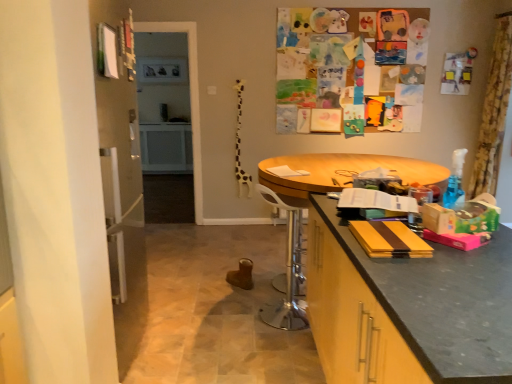
Question: Is yellow floral fabric curtain at upper right bigger than wooden round table at center?

Choices:
 (A) yes
 (B) no

Answer: (B)

Question: Can you confirm if yellow floral fabric curtain at upper right is positioned to the right of wooden round table at center?

Choices:
 (A) no
 (B) yes

Answer: (B)

Question: Considering the relative positions of yellow floral fabric curtain at upper right and wooden round table at center in the image provided, is yellow floral fabric curtain at upper right in front of wooden round table at center?

Choices:
 (A) no
 (B) yes

Answer: (A)

Question: Is yellow floral fabric curtain at upper right to the left of wooden round table at center from the viewer's perspective?

Choices:
 (A) yes
 (B) no

Answer: (B)

Question: Is yellow floral fabric curtain at upper right facing towards wooden round table at center?

Choices:
 (A) no
 (B) yes

Answer: (A)

Question: Choose the correct answer: Is matte black countertop at right inside white plastic swivel chair at center or outside it?

Choices:
 (A) outside
 (B) inside

Answer: (A)

Question: From the image's perspective, relative to white plastic swivel chair at center, is matte black countertop at right above or below?

Choices:
 (A) below
 (B) above

Answer: (A)

Question: Based on their sizes in the image, would you say matte black countertop at right is bigger or smaller than white plastic swivel chair at center?

Choices:
 (A) big
 (B) small

Answer: (A)

Question: Is point (444, 372) positioned closer to the camera than point (293, 296)?

Choices:
 (A) closer
 (B) farther

Answer: (A)

Question: From a real-world perspective, relative to wooden round table at center, is matte black countertop at right vertically above or below?

Choices:
 (A) above
 (B) below

Answer: (B)

Question: Which is correct: matte black countertop at right is inside wooden round table at center, or outside of it?

Choices:
 (A) inside
 (B) outside

Answer: (B)

Question: Is point (489, 251) closer or farther from the camera than point (321, 155)?

Choices:
 (A) closer
 (B) farther

Answer: (A)

Question: Considering the relative positions of matte black countertop at right and wooden round table at center in the image provided, is matte black countertop at right to the left or to the right of wooden round table at center?

Choices:
 (A) left
 (B) right

Answer: (B)

Question: Considering the positions of yellow floral fabric curtain at upper right and white plastic swivel chair at center in the image, is yellow floral fabric curtain at upper right taller or shorter than white plastic swivel chair at center?

Choices:
 (A) short
 (B) tall

Answer: (B)

Question: Based on their sizes in the image, would you say yellow floral fabric curtain at upper right is bigger or smaller than white plastic swivel chair at center?

Choices:
 (A) small
 (B) big

Answer: (B)